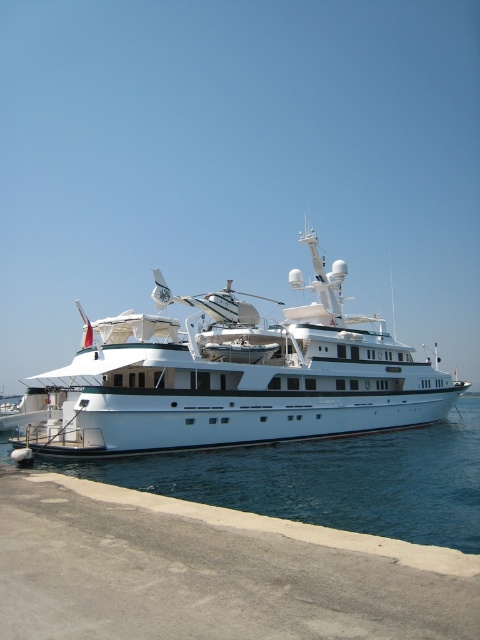
You are a photographer planning to take a photo of the white glossy yacht at center and the clear blue water at lower center. Based on their sizes, which object should you focus on first to ensure proper framing?

The white glossy yacht at center is much taller than the clear blue water at lower center, so you should focus on the white glossy yacht at center first to ensure proper framing due to its larger size.

You are a photographer planning to take a photo of the white glossy yacht at center and the clear blue water at lower center. Based on their sizes, which one should you focus on to ensure it fills most of the frame?

The white glossy yacht at center is larger in size than the clear blue water at lower center, so focusing on it will fill most of the frame.

Consider the image. You are standing on the pier looking at the white glossy yacht at center and the clear blue water at lower center. Which object is positioned to the right side from your viewpoint?

The white glossy yacht at center is positioned to the right of the clear blue water at lower center, so the white glossy yacht at center is on the right side from your viewpoint.